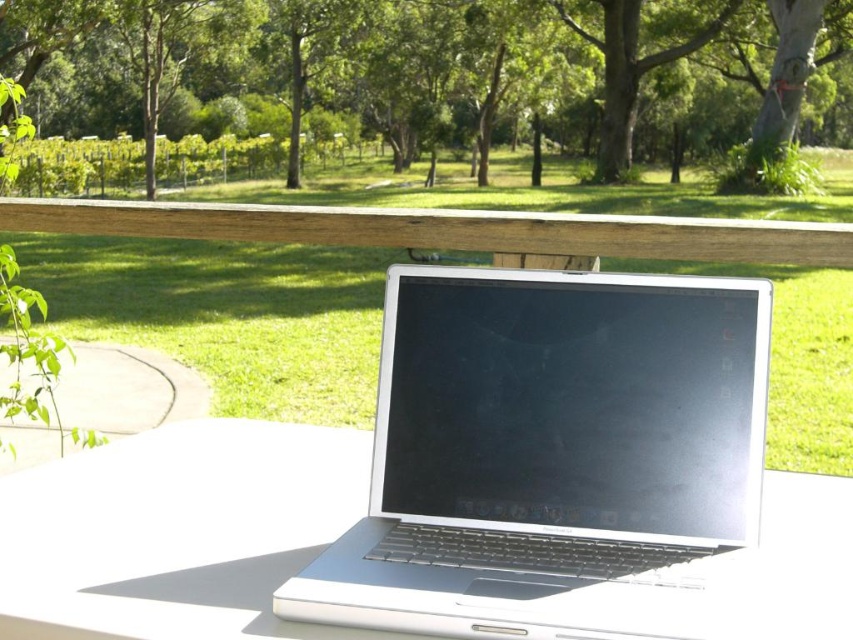
Question: Which point is closer to the camera taking this photo?

Choices:
 (A) (486, 240)
 (B) (625, 280)
 (C) (463, 93)

Answer: (B)

Question: Which point appears closest to the camera in this image?

Choices:
 (A) (529, 216)
 (B) (505, 500)
 (C) (273, 422)

Answer: (B)

Question: Which of the following is the farthest from the observer?

Choices:
 (A) (537, 122)
 (B) (660, 516)
 (C) (791, 225)
 (D) (302, 440)

Answer: (A)

Question: Is green leafy tree at upper center wider than wooden rail at upper center?

Choices:
 (A) yes
 (B) no

Answer: (A)

Question: Is the position of sleek silver laptop at center more distant than that of wooden rail at upper center?

Choices:
 (A) no
 (B) yes

Answer: (A)

Question: Observing the image, what is the correct spatial positioning of green leafy tree at upper center in reference to wooden rail at upper center?

Choices:
 (A) right
 (B) left

Answer: (A)